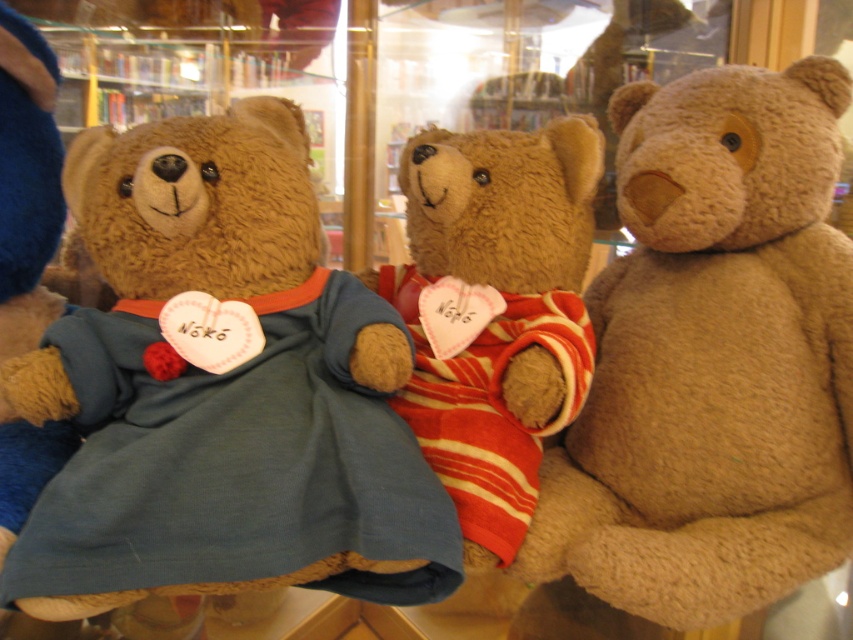
Does velvety brown teddy bear at center appear on the left side of fuzzy brown teddy bear at right?

Correct, you'll find velvety brown teddy bear at center to the left of fuzzy brown teddy bear at right.

Is point (321, 419) closer to viewer compared to point (811, 180)?

Yes, point (321, 419) is closer to viewer.

Image resolution: width=853 pixels, height=640 pixels. What are the coordinates of `velvety brown teddy bear at center` in the screenshot? It's located at (221, 392).

Can you confirm if velvety brown teddy bear at center is smaller than soft brown teddy bear at center?

No.

How much distance is there between velvety brown teddy bear at center and soft brown teddy bear at center?

velvety brown teddy bear at center is 7.24 inches away from soft brown teddy bear at center.

Between point (381, 305) and point (575, 316), which one is positioned behind?

Positioned behind is point (575, 316).

The width and height of the screenshot is (853, 640). Identify the location of velvety brown teddy bear at center. (221, 392).

Is fuzzy brown teddy bear at right below soft brown teddy bear at center?

Yes.

In the scene shown: Measure the distance from fuzzy brown teddy bear at right to soft brown teddy bear at center.

They are 5.75 inches apart.

Who is more forward, (682,353) or (503,400)?

Point (503,400) is in front.

The width and height of the screenshot is (853, 640). Find the location of `fuzzy brown teddy bear at right`. fuzzy brown teddy bear at right is located at coordinates (706, 368).